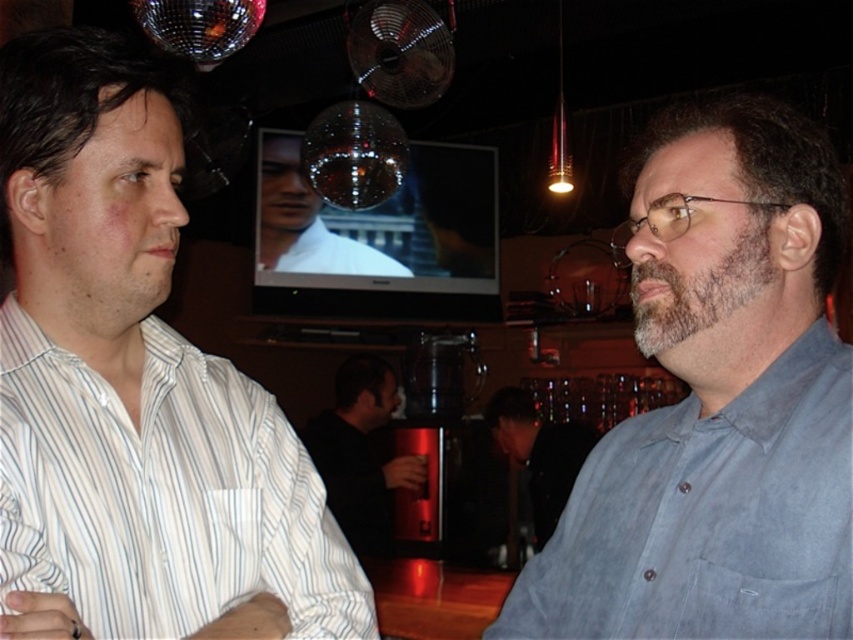
Is point (274, 458) closer to camera compared to point (392, 385)?

Yes, point (274, 458) is in front of point (392, 385).

Is the position of white striped cotton shirt at left more distant than that of black matte shirt at center?

No.

Between point (161, 348) and point (380, 397), which one is positioned in front?

Point (161, 348) is in front.

You are a GUI agent. You are given a task and a screenshot of the screen. Output one action in this format:
    pyautogui.click(x=<x>, y=<y>)
    Task: Click on the white striped cotton shirt at left
    Image resolution: width=853 pixels, height=640 pixels.
    Given the screenshot: What is the action you would take?
    pyautogui.click(x=161, y=493)

Can you confirm if black matte shirt at center is taller than dark gray shirt at center?

Indeed, black matte shirt at center has a greater height compared to dark gray shirt at center.

Identify the location of black matte shirt at center. Image resolution: width=853 pixels, height=640 pixels. (361, 454).

Locate an element on the screen. Image resolution: width=853 pixels, height=640 pixels. black matte shirt at center is located at coordinates (361, 454).

Which is more to the right, gray cotton shirt at right or white striped cotton shirt at left?

gray cotton shirt at right is more to the right.

Between gray cotton shirt at right and white striped cotton shirt at left, which one is positioned higher?

gray cotton shirt at right is above.

Between point (722, 268) and point (238, 541), which one is positioned behind?

The point (238, 541) is more distant.

Locate an element on the screen. gray cotton shirt at right is located at coordinates (717, 401).